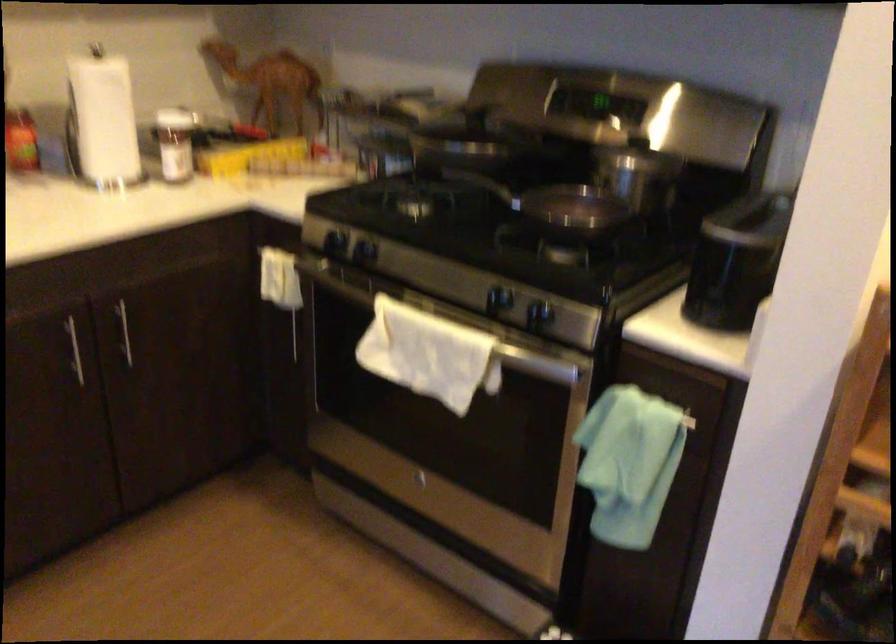
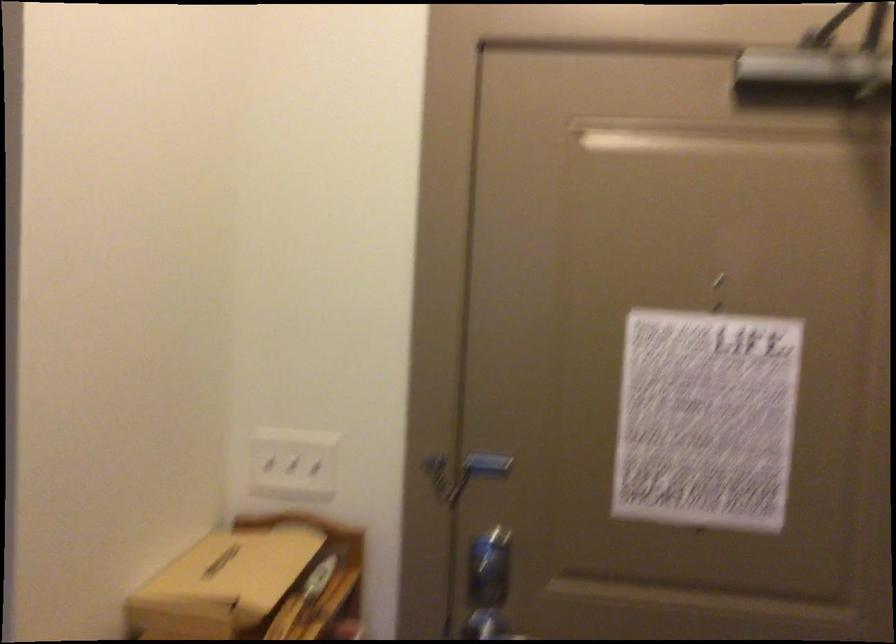
First-person continuous shooting, in which direction is the camera rotating?

The camera rotated toward right-up.